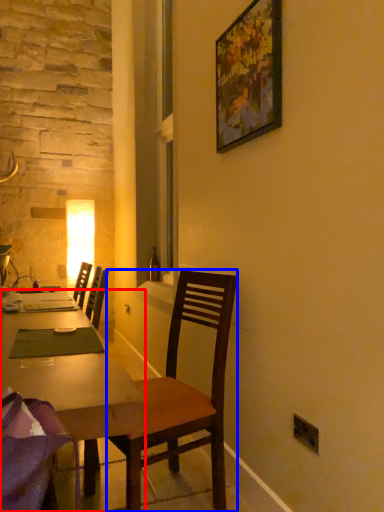
Question: Which of the following is the closest to the observer, desk (highlighted by a red box) or chair (highlighted by a blue box)?

Choices:
 (A) desk
 (B) chair

Answer: (A)